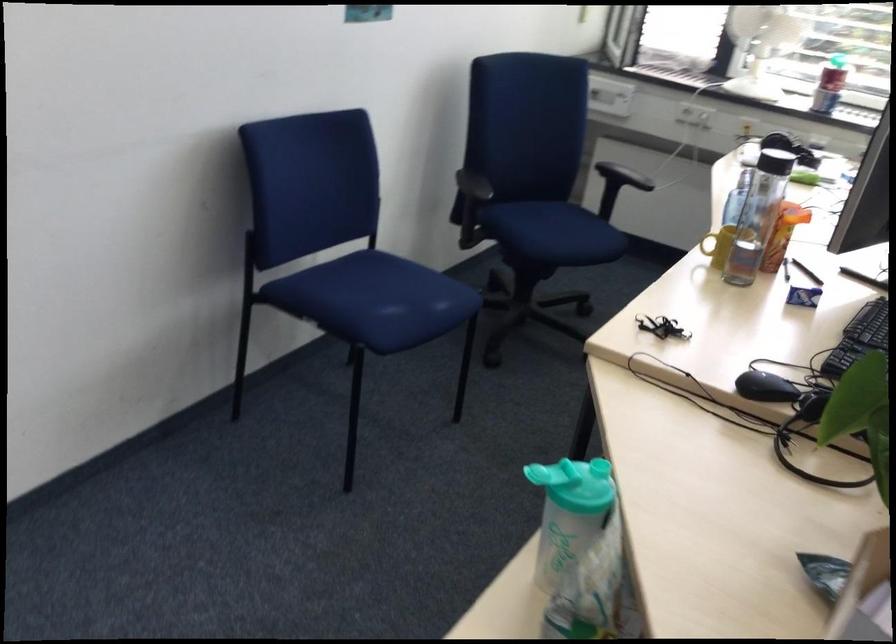
The image size is (896, 644). What do you see at coordinates (599, 468) in the screenshot?
I see `the green bottle lid` at bounding box center [599, 468].